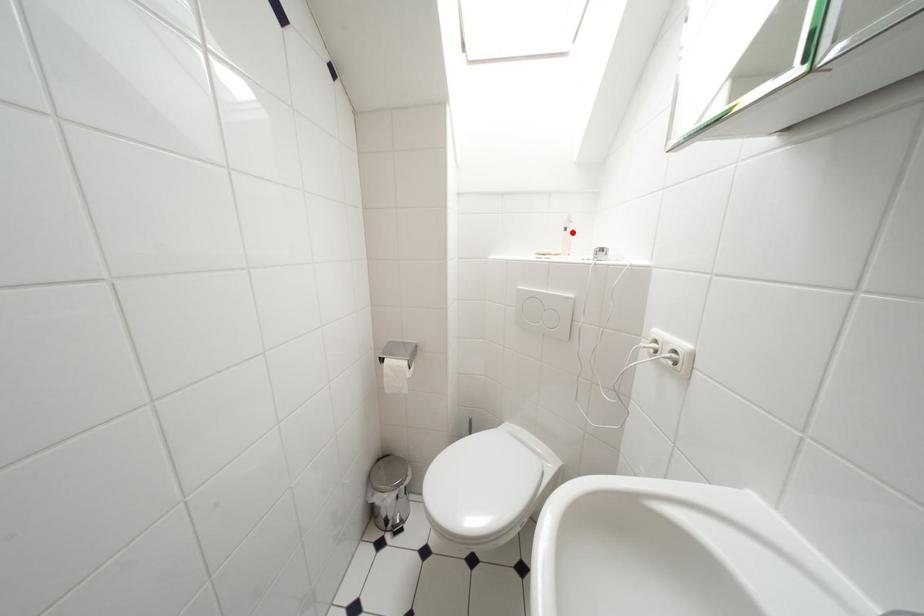
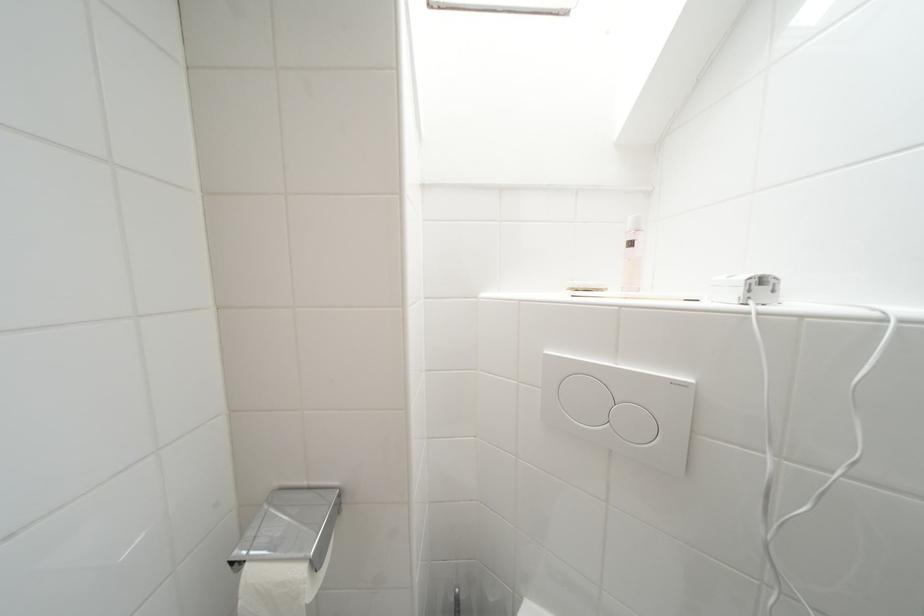
Question: I am providing you with two images of the same scene from different viewpoints. A red point is marked on the first image. Is the red point's position out of view in image 2?

Choices:
 (A) Yes
 (B) No

Answer: (B)